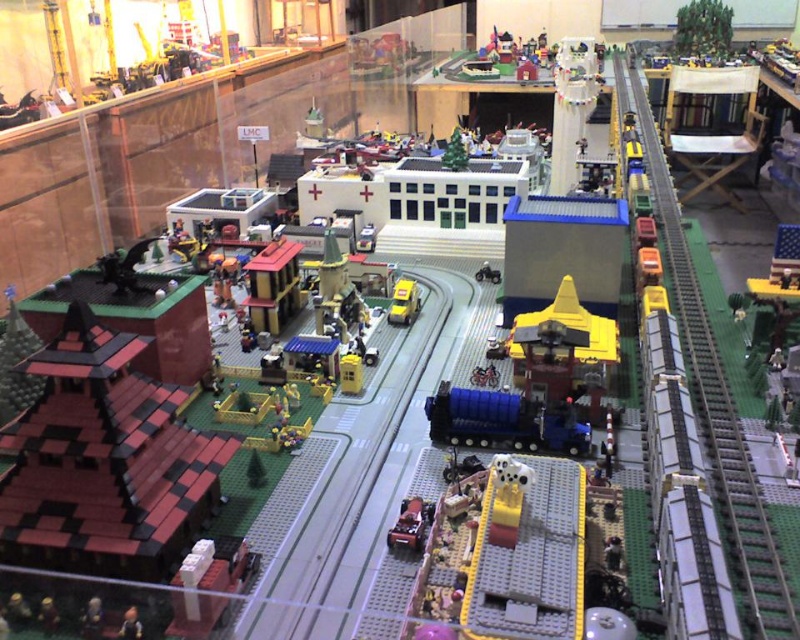
Does metallic silver train at center lie behind yellow plastic car at center?

No, it is not.

Who is lower down, metallic silver train at center or yellow plastic car at center?

metallic silver train at center

Is point (424, 518) positioned before point (389, 314)?

That is True.

This screenshot has height=640, width=800. I want to click on metallic silver train at center, so click(412, 524).

Can you confirm if green plastic train track at right is shorter than yellow plastic car at center?

In fact, green plastic train track at right may be taller than yellow plastic car at center.

This screenshot has height=640, width=800. What do you see at coordinates (720, 417) in the screenshot?
I see `green plastic train track at right` at bounding box center [720, 417].

The height and width of the screenshot is (640, 800). Find the location of `green plastic train track at right`. green plastic train track at right is located at coordinates [x=720, y=417].

Who is positioned more to the right, green plastic train track at right or metallic silver train at center?

green plastic train track at right is more to the right.

Does point (770, 602) come farther from viewer compared to point (430, 522)?

No, (770, 602) is closer to viewer.

The width and height of the screenshot is (800, 640). I want to click on green plastic train track at right, so click(720, 417).

This screenshot has height=640, width=800. What are the coordinates of `green plastic train track at right` in the screenshot? It's located at (720, 417).